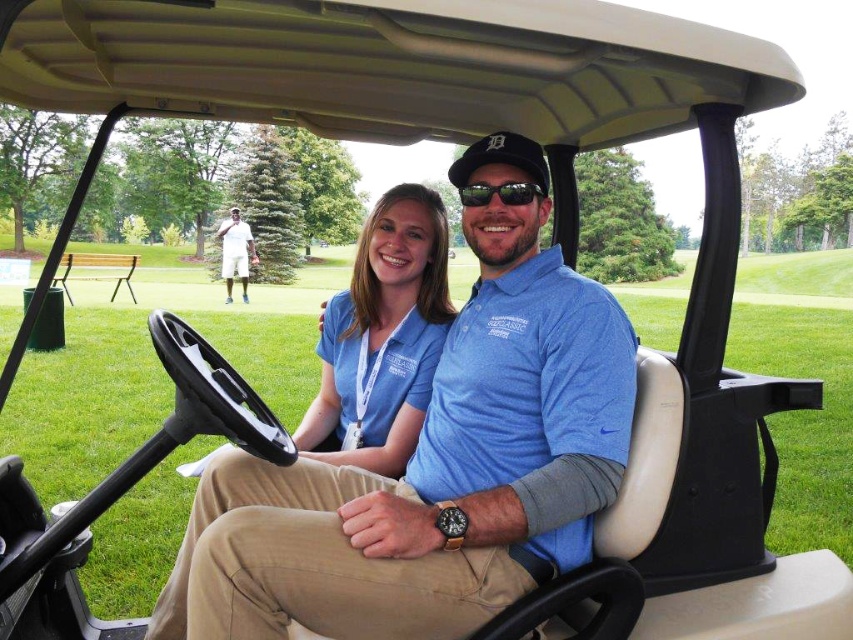
You are standing 1.5 meters away from the golf cart. You want to hand a water bottle to the person wearing the blue cotton shirt at center. Can you reach them without moving closer?

The blue cotton shirt at center is 1.27 meters away from the viewer, so yes, you can reach them without moving closer since the distance is within arm reach.

You are standing on the golf course and see two points marked on the ground near the golf cart. The first point is at coordinates point (369, 419) and the second is at point (242, 244). If you want to place a flag closer to the viewer, which point should you choose?

Point (369, 419) is closer to the viewer than point (242, 244), so you should choose point (369, 419) to place the flag closer to the viewer.

You are a photographer positioned to take a portrait of both individuals wearing blue shirts in the golf cart. Which shirt, the blue cotton shirt at center or the matte blue shirt at center, will appear larger in your photo?

The blue cotton shirt at center will appear larger in the photo because it is closer to the viewer than the matte blue shirt at center.